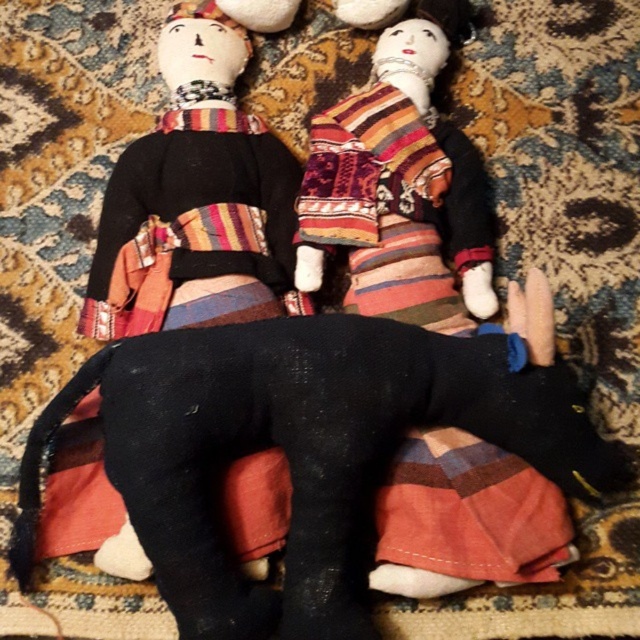
You are observing two points in the image. The first point is at coordinates point (348, 637) and the second is at point (360, 99). Based on their positions, which point is closer to you?

Point (348, 637) is closer to the viewer than point (360, 99).

You are a child trying to decide which doll to play with. The matte black doll at left is bigger than the textured multicolored fabric rag doll at center. Which doll would you choose if you prefer a smaller, more delicate toy?

The textured multicolored fabric rag doll at center is smaller and more delicate, so you would choose that one.

You are a photographer setting up a shot of the black fabric dog at center. The camera is positioned 40 inches away. Will the dog be in focus if the depth of field only covers 38 inches?

The black fabric dog at center is 38.30 inches away from the camera. Since the depth of field covers 38 inches, the dog will be slightly out of focus.